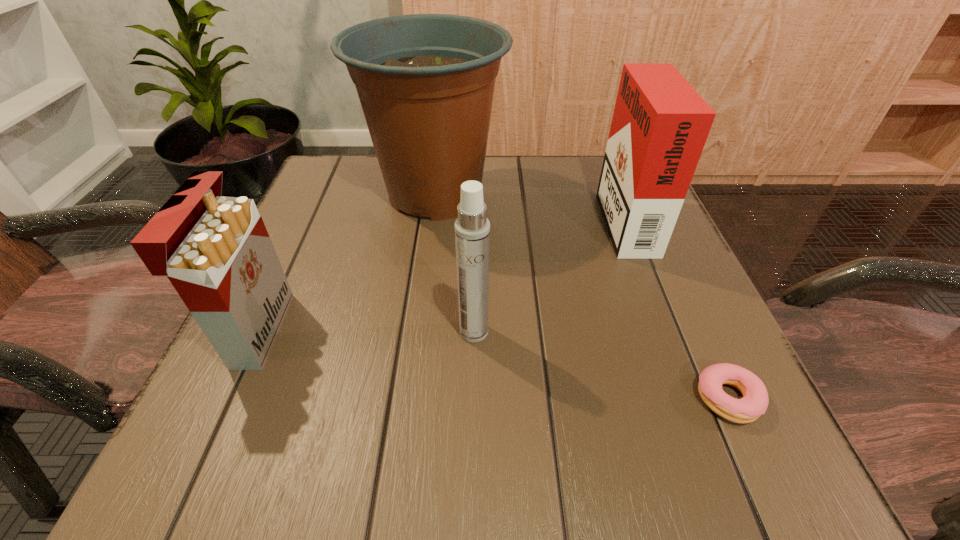
This screenshot has width=960, height=540. Identify the location of flowerpot. (425, 82).

The width and height of the screenshot is (960, 540). I want to click on the right cigarette case, so click(x=660, y=124).

At what (x,y) coordinates should I click in order to perform the action: click on aerosol can. Please return your answer as a coordinate pair (x, y). The height and width of the screenshot is (540, 960). Looking at the image, I should click on (472, 228).

Locate an element on the screen. This screenshot has height=540, width=960. the shorter cigarette case is located at coordinates (215, 250).

At what (x,y) coordinates should I click in order to perform the action: click on the left cigarette case. Please return your answer as a coordinate pair (x, y). The image size is (960, 540). Looking at the image, I should click on (215, 250).

Where is `the shortest object`? The image size is (960, 540). the shortest object is located at coordinates (754, 403).

Image resolution: width=960 pixels, height=540 pixels. I want to click on the nearest object, so click(x=754, y=403).

I want to click on blank space located on the right of the flowerpot, so click(x=627, y=194).

You are a GUI agent. You are given a task and a screenshot of the screen. Output one action in this format:
    pyautogui.click(x=<x>, y=<y>)
    Task: Click on the blank space located on the front-facing side of the farther cigarette case
    This screenshot has height=540, width=960.
    Given the screenshot: What is the action you would take?
    pyautogui.click(x=436, y=217)

Locate an element on the screen. The width and height of the screenshot is (960, 540). vacant region located on the front-facing side of the farther cigarette case is located at coordinates (513, 217).